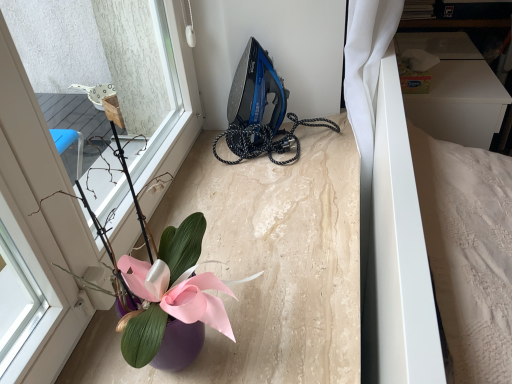
Question: Does purple glossy vase at lower left appear on the right side of white matte bed at right?

Choices:
 (A) no
 (B) yes

Answer: (A)

Question: Is the depth of purple glossy vase at lower left less than that of white matte bed at right?

Choices:
 (A) yes
 (B) no

Answer: (A)

Question: Does purple glossy vase at lower left turn towards white matte bed at right?

Choices:
 (A) yes
 (B) no

Answer: (B)

Question: Is the depth of purple glossy vase at lower left greater than that of white matte bed at right?

Choices:
 (A) yes
 (B) no

Answer: (B)

Question: Can you see purple glossy vase at lower left touching white matte bed at right?

Choices:
 (A) yes
 (B) no

Answer: (B)

Question: Is white matte bed at right inside purple glossy vase at lower left?

Choices:
 (A) no
 (B) yes

Answer: (A)

Question: Is blue glossy iron at upper center positioned beyond the bounds of white matte bed at right?

Choices:
 (A) yes
 (B) no

Answer: (A)

Question: From a real-world perspective, is blue glossy iron at upper center beneath white matte bed at right?

Choices:
 (A) no
 (B) yes

Answer: (A)

Question: Is blue glossy iron at upper center thinner than white matte bed at right?

Choices:
 (A) yes
 (B) no

Answer: (A)

Question: Is blue glossy iron at upper center to the right of white matte bed at right from the viewer's perspective?

Choices:
 (A) no
 (B) yes

Answer: (A)

Question: Does blue glossy iron at upper center have a greater width compared to white matte bed at right?

Choices:
 (A) yes
 (B) no

Answer: (B)

Question: From the image's perspective, is blue glossy iron at upper center located above white matte bed at right?

Choices:
 (A) no
 (B) yes

Answer: (B)

Question: Considering the relative sizes of white matte bed at right and purple glossy vase at lower left in the image provided, is white matte bed at right thinner than purple glossy vase at lower left?

Choices:
 (A) yes
 (B) no

Answer: (B)